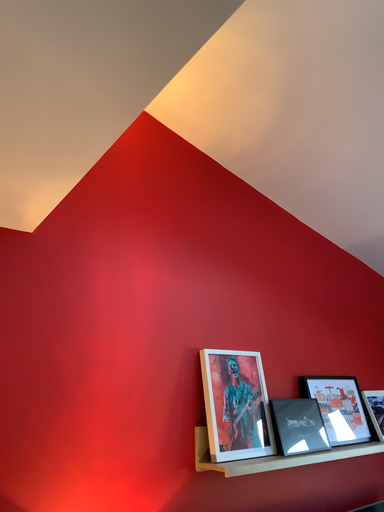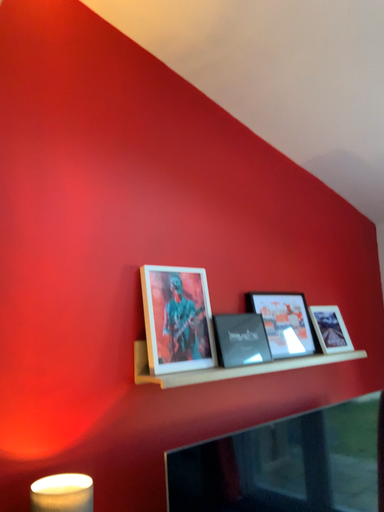
Question: Which way did the camera rotate in the video?

Choices:
 (A) rotated downward
 (B) rotated upward

Answer: (A)